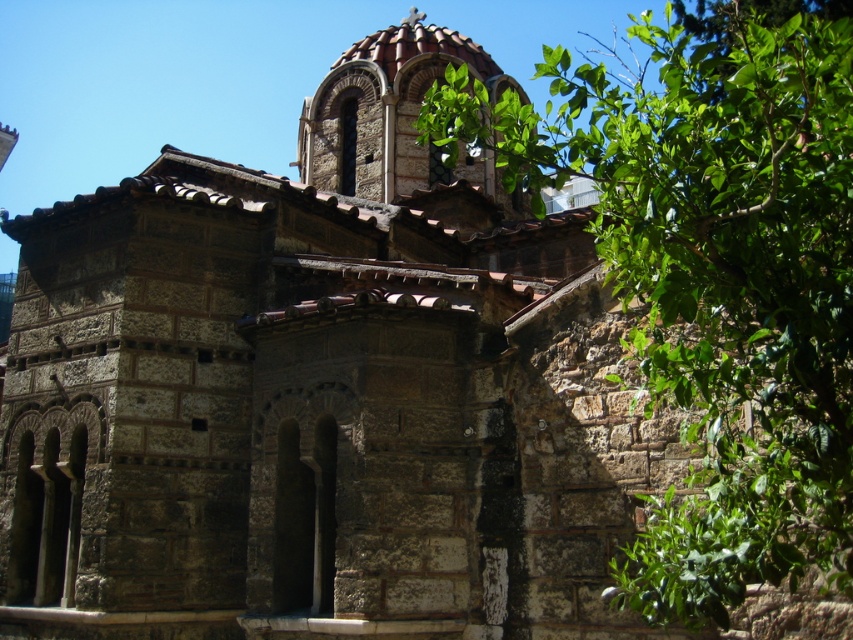
Question: Which point is closer to the camera?

Choices:
 (A) brown stone dome at upper center
 (B) green leafy tree at upper right

Answer: (B)

Question: Does green leafy tree at upper right have a greater width compared to brown stone dome at upper center?

Choices:
 (A) yes
 (B) no

Answer: (A)

Question: Which object appears closest to the camera in this image?

Choices:
 (A) brown stone dome at upper center
 (B) green leafy tree at upper right

Answer: (B)

Question: Is green leafy tree at upper right bigger than brown stone dome at upper center?

Choices:
 (A) yes
 (B) no

Answer: (A)

Question: Which of the following is the closest to the observer?

Choices:
 (A) green leafy tree at upper right
 (B) brown stone dome at upper center

Answer: (A)

Question: Is green leafy tree at upper right to the left of brown stone dome at upper center from the viewer's perspective?

Choices:
 (A) no
 (B) yes

Answer: (A)